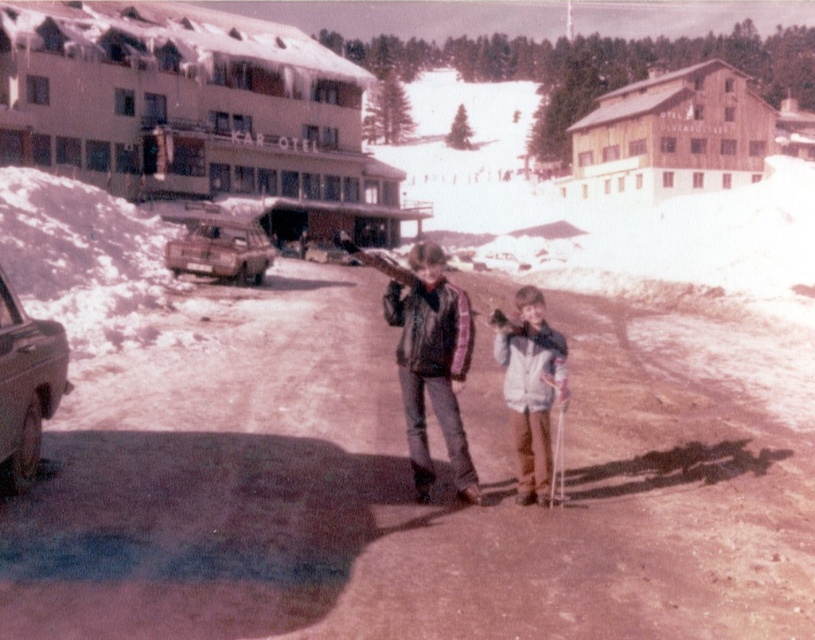
Looking at this image, does shiny silver sedan at left appear on the right side of rusty metallic truck at center-left?

Yes, shiny silver sedan at left is to the right of rusty metallic truck at center-left.

Can you confirm if shiny silver sedan at left is thinner than rusty metallic truck at center-left?

Yes.

Which is behind, point (7, 420) or point (269, 244)?

Positioned behind is point (269, 244).

Find the location of a particular element. shiny silver sedan at left is located at coordinates [25, 387].

Is white matte jacket at center positioned at the back of shiny silver sedan at left?

Yes, it is behind shiny silver sedan at left.

Can you confirm if white matte jacket at center is smaller than shiny silver sedan at left?

No.

Which is behind, point (491, 323) or point (20, 332)?

Positioned behind is point (491, 323).

Where is `white matte jacket at center`? white matte jacket at center is located at coordinates (531, 387).

What do you see at coordinates (432, 365) in the screenshot?
I see `leather jacket at center` at bounding box center [432, 365].

Where is `leather jacket at center`? leather jacket at center is located at coordinates (432, 365).

Find the location of a particular element. leather jacket at center is located at coordinates (432, 365).